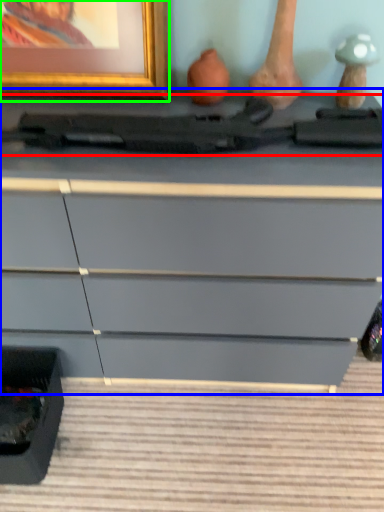
Question: Which is nearer to the equipment (highlighted by a red box)? chest of drawers (highlighted by a blue box) or picture frame (highlighted by a green box).

Choices:
 (A) chest of drawers
 (B) picture frame

Answer: (B)